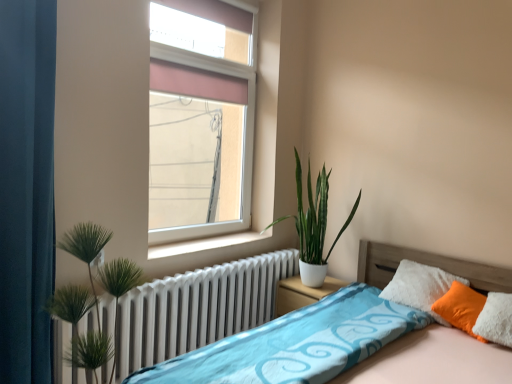
Question: Is blue fabric bed at lower right to the left of orange fabric pillow at right from the viewer's perspective?

Choices:
 (A) no
 (B) yes

Answer: (B)

Question: Is there a large distance between blue fabric bed at lower right and orange fabric pillow at right?

Choices:
 (A) yes
 (B) no

Answer: (B)

Question: Can you confirm if blue fabric bed at lower right is thinner than orange fabric pillow at right?

Choices:
 (A) yes
 (B) no

Answer: (B)

Question: Does blue fabric bed at lower right have a smaller size compared to orange fabric pillow at right?

Choices:
 (A) no
 (B) yes

Answer: (A)

Question: Is blue fabric bed at lower right outside orange fabric pillow at right?

Choices:
 (A) no
 (B) yes

Answer: (B)

Question: From the image's perspective, is blue fabric bed at lower right on orange fabric pillow at right?

Choices:
 (A) no
 (B) yes

Answer: (A)

Question: Considering the relative positions of white metallic radiator at lower left and orange fabric pillow at right in the image provided, is white metallic radiator at lower left in front of orange fabric pillow at right?

Choices:
 (A) yes
 (B) no

Answer: (A)

Question: Is white metallic radiator at lower left completely or partially outside of orange fabric pillow at right?

Choices:
 (A) no
 (B) yes

Answer: (B)

Question: Are white metallic radiator at lower left and orange fabric pillow at right making contact?

Choices:
 (A) yes
 (B) no

Answer: (B)

Question: From a real-world perspective, is white metallic radiator at lower left on orange fabric pillow at right?

Choices:
 (A) no
 (B) yes

Answer: (A)

Question: From a real-world perspective, is white metallic radiator at lower left physically below orange fabric pillow at right?

Choices:
 (A) yes
 (B) no

Answer: (A)

Question: Would you say white metallic radiator at lower left contains orange fabric pillow at right?

Choices:
 (A) no
 (B) yes

Answer: (A)

Question: From the image's perspective, does teal fabric curtain at left appear lower than blue fabric bed at lower right?

Choices:
 (A) yes
 (B) no

Answer: (B)